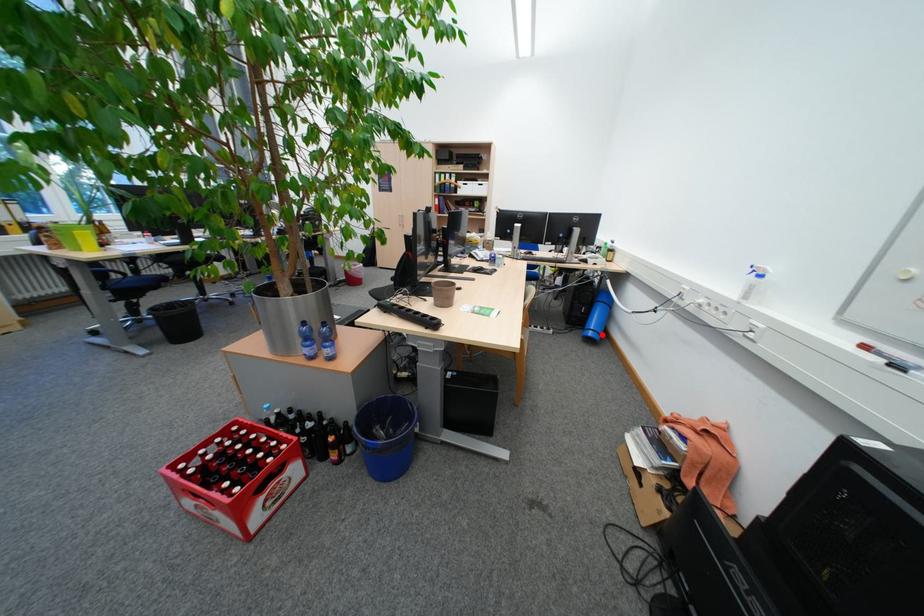
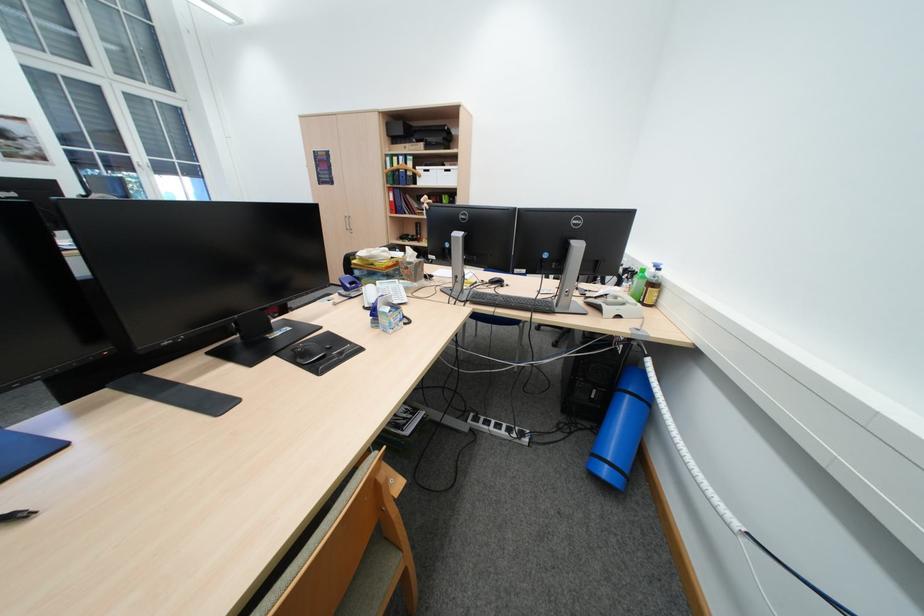
Question: I am providing you with two images of the same scene from different viewpoints. In image1, a red point is highlighted. Considering the same 3D point in image2, which of the following is correct?

Choices:
 (A) It is closer
 (B) It is farther

Answer: (B)